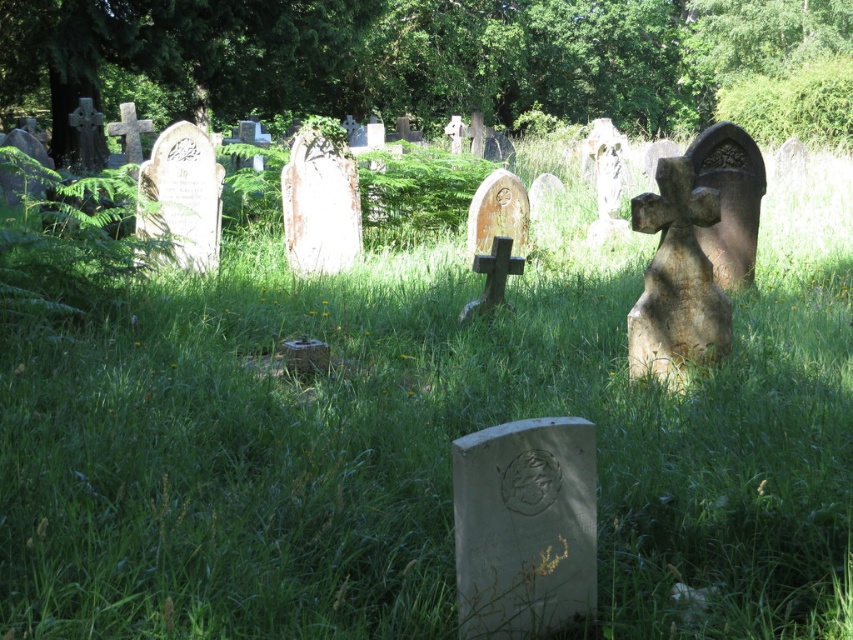
You are standing in the cemetery and want to take a photo of the green leafy tree at upper center. Which direction should you face to ensure the tree is in the center of your photo?

The green leafy tree at upper center is located at point coordinates, so you should face the upper center direction to have it centered in your photo.

You are a gardener needing to mow the lawn between the green leafy tree at upper center and the gray stone gravestone at center. Your lawnmower has a maximum operational range of 50 feet. Can you mow the entire area between them without needing to recharge?

The distance between the green leafy tree at upper center and the gray stone gravestone at center is 51.00 feet, which exceeds the lawnmower maximum operational range of 50 feet. Therefore, you cannot mow the entire area between them without needing to recharge.

You are a gardener planning to trim the green leafy tree at upper center and the gray stone gravestone at center. Which object requires more horizontal space for trimming? Please explain your reasoning based on their sizes.

The green leafy tree at upper center might require more horizontal space for trimming than the gray stone gravestone at center because it might be wider according to the description.